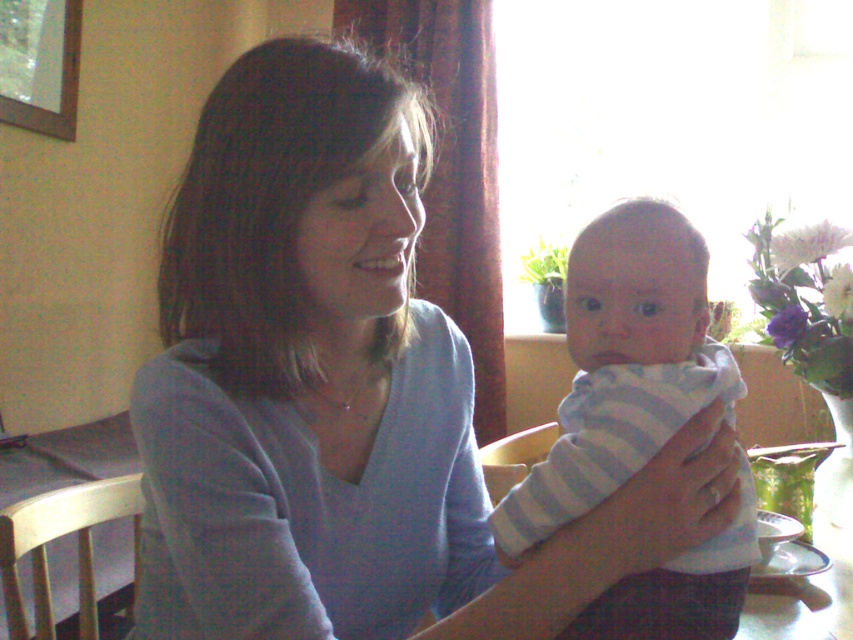
You are an interior designer analyzing the placement of objects in the room. The matte blue sweater at center is part of the scene. Can you determine its exact coordinates in the image?

The matte blue sweater at center is located at coordinates point (344, 394).

You are a photographer setting up for a family portrait. The scene includes a matte blue sweater at center and a light blue striped cloth at center. You need to position a camera 6 inches away from the closest object to ensure focus. Can you fit both objects within the camera frame without moving them?

The matte blue sweater at center is 5.54 inches from the light blue striped cloth at center. Since the camera needs to be 6 inches away from the closest object, the distance between them is less than the required camera positioning distance. Therefore, positioning the camera 6 inches away from the nearest object would leave the other object beyond the frame, making it impossible to capture both without moving them.

You are a photographer setting up for a family portrait. You notice the matte blue sweater at center and the light blue striped cloth at center in the scene. Which item should you adjust to ensure both are visible in the frame without cropping?

The matte blue sweater at center is taller than the light blue striped cloth at center. To ensure both are visible, adjust the matte blue sweater at center to avoid cropping the taller item.